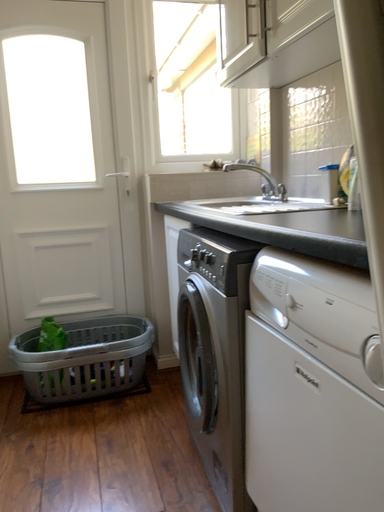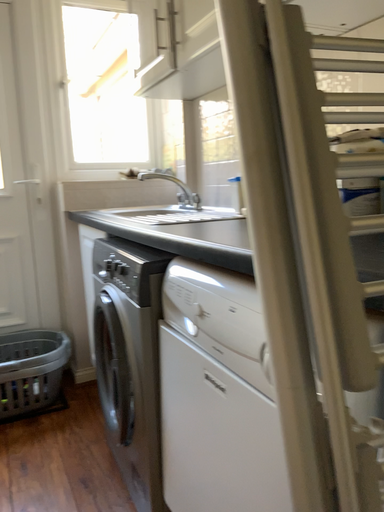
Question: Which way did the camera rotate in the video?

Choices:
 (A) rotated right
 (B) rotated left

Answer: (A)